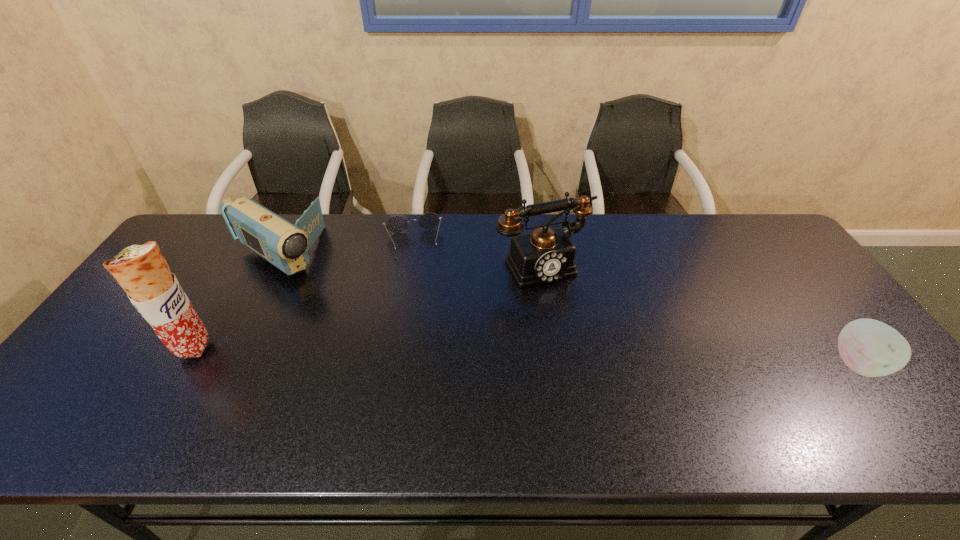
Where is `telephone at the far edge`? telephone at the far edge is located at coordinates (546, 255).

Locate an element on the screen. Image resolution: width=960 pixels, height=540 pixels. camcorder positioned at the far edge is located at coordinates (x=285, y=245).

Locate an element on the screen. object positioned at the near edge is located at coordinates (871, 348).

Find the location of a particular element. Image resolution: width=960 pixels, height=540 pixels. object present at the right edge is located at coordinates (871, 348).

Locate an element on the screen. object present at the near right corner is located at coordinates (871, 348).

Where is `free region at the far edge`? Image resolution: width=960 pixels, height=540 pixels. free region at the far edge is located at coordinates (642, 234).

You are a GUI agent. You are given a task and a screenshot of the screen. Output one action in this format:
    pyautogui.click(x=<x>, y=<y>)
    Task: Click on the vacant space at the left edge of the desktop
    
    Given the screenshot: What is the action you would take?
    pyautogui.click(x=182, y=287)

Where is `vacant space at the far left corner of the desktop`? This screenshot has width=960, height=540. vacant space at the far left corner of the desktop is located at coordinates (181, 245).

This screenshot has width=960, height=540. Identify the location of blank space at the far right corner of the desktop. (723, 216).

This screenshot has height=540, width=960. I want to click on vacant area at the near right corner of the desktop, so click(x=897, y=400).